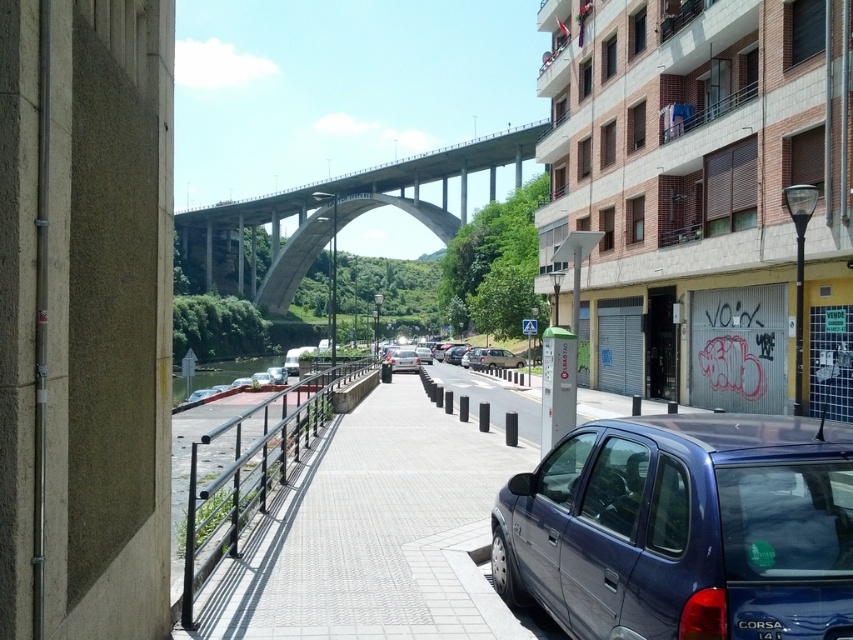
Based on the photo, measure the distance between concrete bridge at center and camera.

concrete bridge at center is 71.49 meters from camera.

Does concrete bridge at center have a lesser width compared to silver metallic hatchback at center?

No.

Is point (320, 189) more distant than point (473, 368)?

That is True.

The height and width of the screenshot is (640, 853). In order to click on concrete bridge at center in this screenshot , I will do (337, 214).

In the scene shown: Can you confirm if metallic blue sedan at lower right is shorter than black plastic license plate at lower right?

No.

Where is `metallic blue sedan at lower right`? The width and height of the screenshot is (853, 640). metallic blue sedan at lower right is located at coordinates coord(682,528).

Where is `metallic blue sedan at lower right`? This screenshot has width=853, height=640. metallic blue sedan at lower right is located at coordinates (682, 528).

Does silver metallic hatchback at center come behind black plastic license plate at lower right?

Yes, it is.

Image resolution: width=853 pixels, height=640 pixels. Describe the element at coordinates (492, 358) in the screenshot. I see `silver metallic hatchback at center` at that location.

Is point (503, 364) positioned after point (752, 621)?

That is True.

Locate an element on the screen. This screenshot has height=640, width=853. silver metallic hatchback at center is located at coordinates (492, 358).